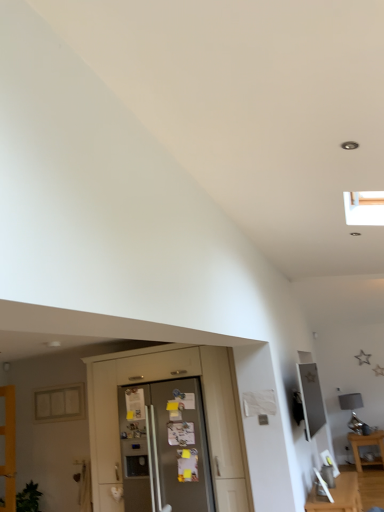
Question: Is wooden table at lower right smaller than matte glass window at left?

Choices:
 (A) no
 (B) yes

Answer: (A)

Question: Can you confirm if wooden table at lower right is thinner than matte glass window at left?

Choices:
 (A) yes
 (B) no

Answer: (B)

Question: Is the surface of wooden table at lower right in direct contact with matte glass window at left?

Choices:
 (A) yes
 (B) no

Answer: (B)

Question: Is wooden table at lower right completely or partially outside of matte glass window at left?

Choices:
 (A) no
 (B) yes

Answer: (B)

Question: Is wooden table at lower right turned away from matte glass window at left?

Choices:
 (A) yes
 (B) no

Answer: (B)

Question: From a real-world perspective, is wooden table at lower right positioned above or below matte glass window at left?

Choices:
 (A) above
 (B) below

Answer: (B)

Question: In terms of size, does wooden table at lower right appear bigger or smaller than matte glass window at left?

Choices:
 (A) small
 (B) big

Answer: (B)

Question: Which is correct: wooden table at lower right is inside matte glass window at left, or outside of it?

Choices:
 (A) outside
 (B) inside

Answer: (A)

Question: Considering the positions of wooden table at lower right and matte glass window at left in the image, is wooden table at lower right wider or thinner than matte glass window at left?

Choices:
 (A) wide
 (B) thin

Answer: (A)

Question: Does point (140, 488) appear closer or farther from the camera than point (6, 394)?

Choices:
 (A) farther
 (B) closer

Answer: (B)

Question: Is satin silver refrigerator at center situated inside wooden door at left or outside?

Choices:
 (A) inside
 (B) outside

Answer: (B)

Question: Considering the positions of satin silver refrigerator at center and wooden door at left in the image, is satin silver refrigerator at center wider or thinner than wooden door at left?

Choices:
 (A) wide
 (B) thin

Answer: (A)

Question: From the image's perspective, is satin silver refrigerator at center located above or below wooden door at left?

Choices:
 (A) below
 (B) above

Answer: (B)

Question: Considering the positions of wooden door at left and metallic silver frame at upper right in the image, is wooden door at left taller or shorter than metallic silver frame at upper right?

Choices:
 (A) tall
 (B) short

Answer: (A)

Question: Looking at the image, does wooden door at left seem bigger or smaller compared to metallic silver frame at upper right?

Choices:
 (A) big
 (B) small

Answer: (A)